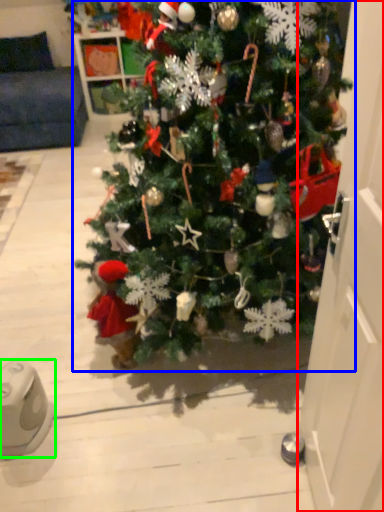
Question: Based on their relative distances, which object is farther from door (highlighted by a red box)? Choose from christmas tree (highlighted by a blue box) and ipod (highlighted by a green box).

Choices:
 (A) christmas tree
 (B) ipod

Answer: (B)